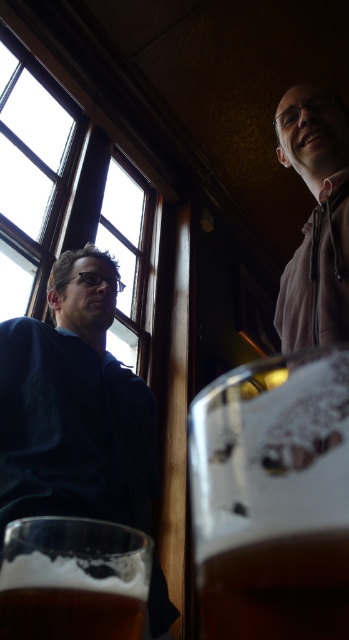
Based on the photo, can you confirm if foamy amber glass at lower right is shorter than wooden frame window at left?

Yes.

Which is behind, point (257, 378) or point (70, 100)?

Point (70, 100)

Locate an element on the screen. foamy amber glass at lower right is located at coordinates (272, 499).

Which is behind, point (90, 355) or point (57, 112)?

Point (57, 112)

Does point (46, 326) come closer to viewer compared to point (129, 300)?

Yes, point (46, 326) is closer to viewer.

Where is `dark blue shirt at left`? This screenshot has width=349, height=640. dark blue shirt at left is located at coordinates (75, 406).

Where is `dark blue shirt at left`? The width and height of the screenshot is (349, 640). dark blue shirt at left is located at coordinates (75, 406).

Who is positioned more to the right, gray hoodie at upper right or brown frothy beer at lower center?

Positioned to the right is gray hoodie at upper right.

Does point (308, 316) come closer to viewer compared to point (233, 611)?

No, (308, 316) is further to viewer.

Between point (322, 209) and point (225, 572), which one is positioned in front?

Point (225, 572)

Where is `gray hoodie at upper right`? gray hoodie at upper right is located at coordinates (315, 220).